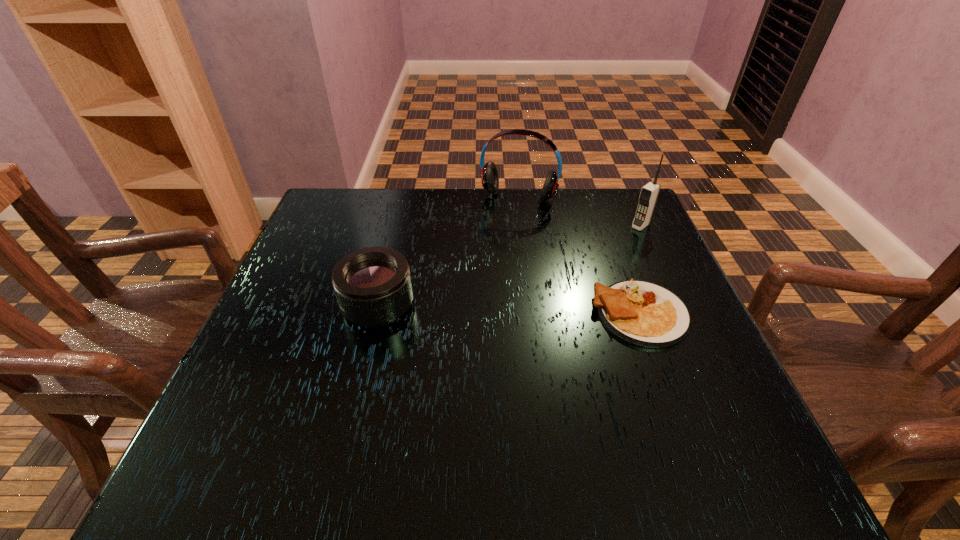
Identify the location of free spot between the leftmost object and the second object from left to right. The width and height of the screenshot is (960, 540). pos(448,255).

This screenshot has width=960, height=540. Identify the location of free area in between the leftmost object and the cellular telephone. (509, 266).

This screenshot has height=540, width=960. What are the coordinates of `free area in between the cellular telephone and the third object from right to left` in the screenshot? It's located at (580, 215).

Locate an element on the screen. free area in between the omelet and the cellular telephone is located at coordinates (640, 269).

The image size is (960, 540). In order to click on unoccupied position between the leftmost object and the cellular telephone in this screenshot , I will do `click(509, 266)`.

What are the coordinates of `unoccupied area between the shortest object and the cellular telephone` in the screenshot? It's located at (640, 269).

At what (x,y) coordinates should I click in order to perform the action: click on the third closest object relative to the shortest object. Please return your answer as a coordinate pair (x, y). Looking at the image, I should click on (373, 287).

Identify the location of object that ranks as the third closest to the leftmost object. (649, 193).